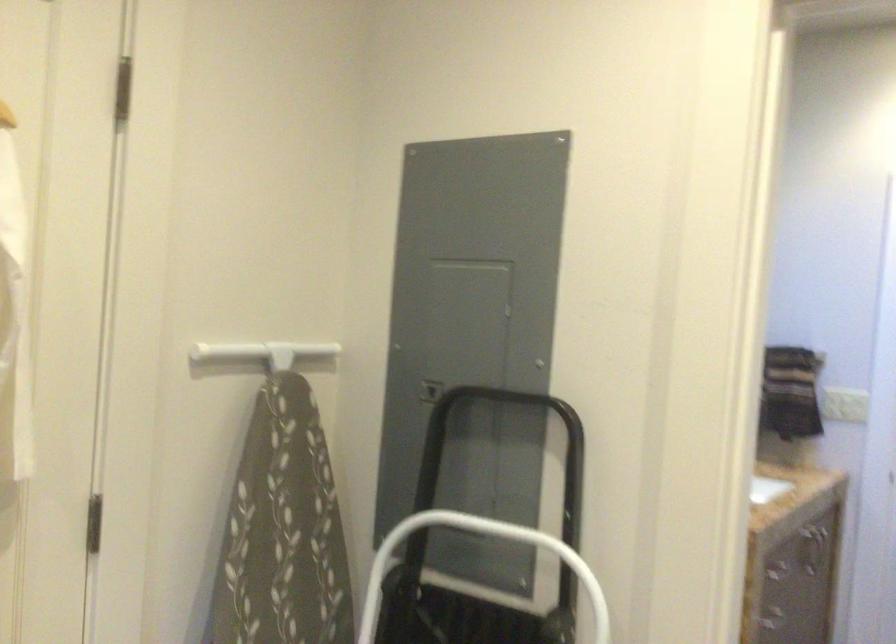
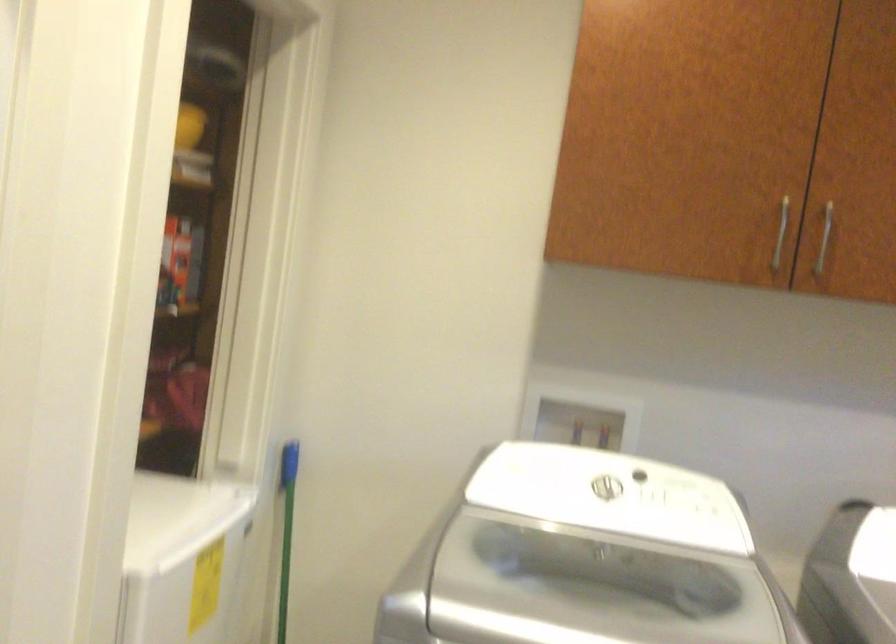
Question: The camera is either moving clockwise (left) or counter-clockwise (right) around the object. The first image is from the beginning of the video and the second image is from the end. Is the camera moving left or right when shooting the video?

Choices:
 (A) Left
 (B) Right

Answer: (A)